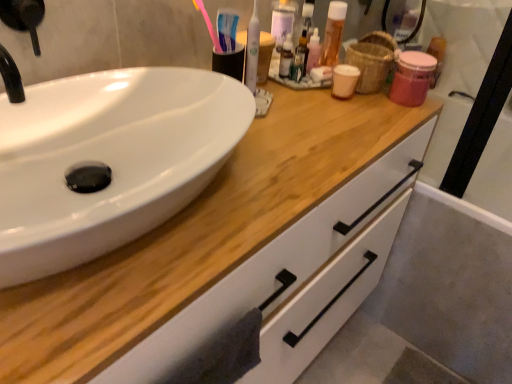
Locate an element on the screen. This screenshot has height=384, width=512. free space in front of brown woven basket at upper right is located at coordinates (362, 114).